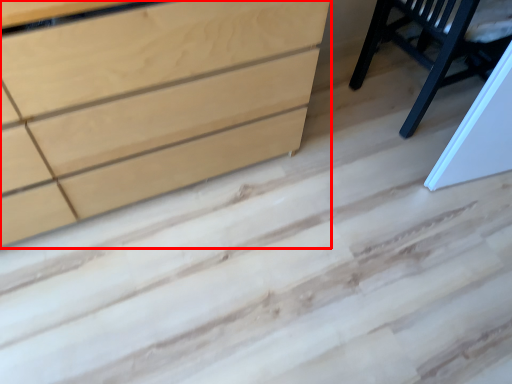
Question: From the image's perspective, what is the correct spatial relationship of chest of drawers (annotated by the red box) in relation to furniture?

Choices:
 (A) above
 (B) below

Answer: (B)